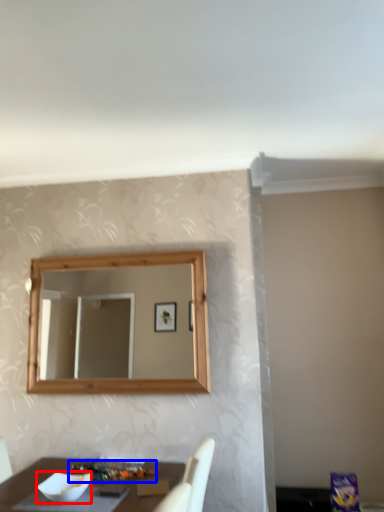
Question: Among these objects, which one is nearest to the camera, bowl (highlighted by a red box) or food (highlighted by a blue box)?

Choices:
 (A) bowl
 (B) food

Answer: (A)